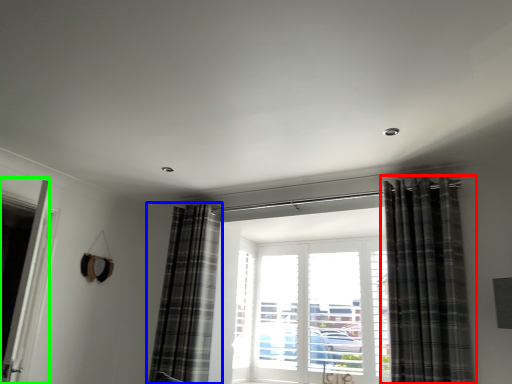
Question: Based on their relative distances, which object is farther from curtain (highlighted by a red box)? Choose from curtain (highlighted by a blue box) and screen door (highlighted by a green box).

Choices:
 (A) curtain
 (B) screen door

Answer: (B)